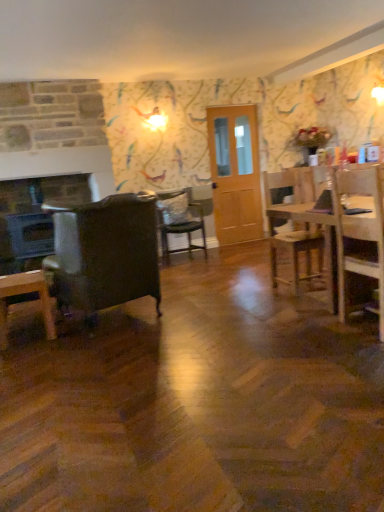
Question: Should I look upward or downward to see black matte laptop at center?

Choices:
 (A) down
 (B) up

Answer: (B)

Question: Is wooden table at right far away from wooden chair at right, positioned as the 3th chair in left-to-right order?

Choices:
 (A) yes
 (B) no

Answer: (B)

Question: Is wooden table at right located outside wooden chair at right, the second chair viewed from the back?

Choices:
 (A) no
 (B) yes

Answer: (B)

Question: Does wooden table at right have a lesser width compared to wooden chair at right, the 1th chair from the right?

Choices:
 (A) yes
 (B) no

Answer: (B)

Question: From the image's perspective, does wooden table at right appear lower than wooden chair at right, the second chair viewed from the back?

Choices:
 (A) yes
 (B) no

Answer: (A)

Question: Is wooden table at right oriented away from wooden chair at right, positioned as the 3th chair in left-to-right order?

Choices:
 (A) yes
 (B) no

Answer: (B)

Question: From a real-world perspective, does wooden table at right sit lower than wooden chair at right, the 1th chair from the right?

Choices:
 (A) yes
 (B) no

Answer: (A)

Question: Is light brown wooden door at center closer to the viewer compared to wooden desk at lower left?

Choices:
 (A) yes
 (B) no

Answer: (B)

Question: From the image's perspective, does light brown wooden door at center appear higher than wooden desk at lower left?

Choices:
 (A) yes
 (B) no

Answer: (A)

Question: Are light brown wooden door at center and wooden desk at lower left located far from each other?

Choices:
 (A) no
 (B) yes

Answer: (B)

Question: Is light brown wooden door at center located outside wooden desk at lower left?

Choices:
 (A) no
 (B) yes

Answer: (B)

Question: Considering the relative sizes of light brown wooden door at center and wooden desk at lower left in the image provided, is light brown wooden door at center taller than wooden desk at lower left?

Choices:
 (A) yes
 (B) no

Answer: (A)

Question: Is light brown wooden door at center positioned with its back to wooden desk at lower left?

Choices:
 (A) yes
 (B) no

Answer: (B)

Question: Does wooden table at right have a smaller size compared to wooden desk at lower left?

Choices:
 (A) yes
 (B) no

Answer: (B)